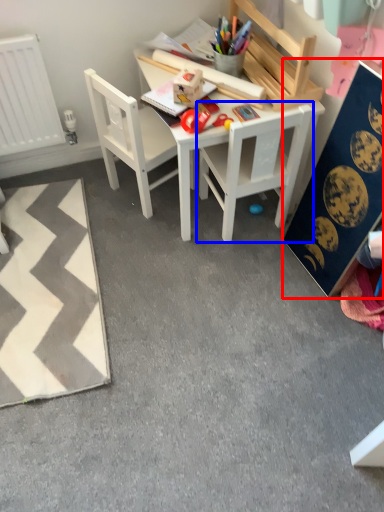
Question: Which object is further to the camera taking this photo, bulletin board (highlighted by a red box) or chair (highlighted by a blue box)?

Choices:
 (A) bulletin board
 (B) chair

Answer: (B)